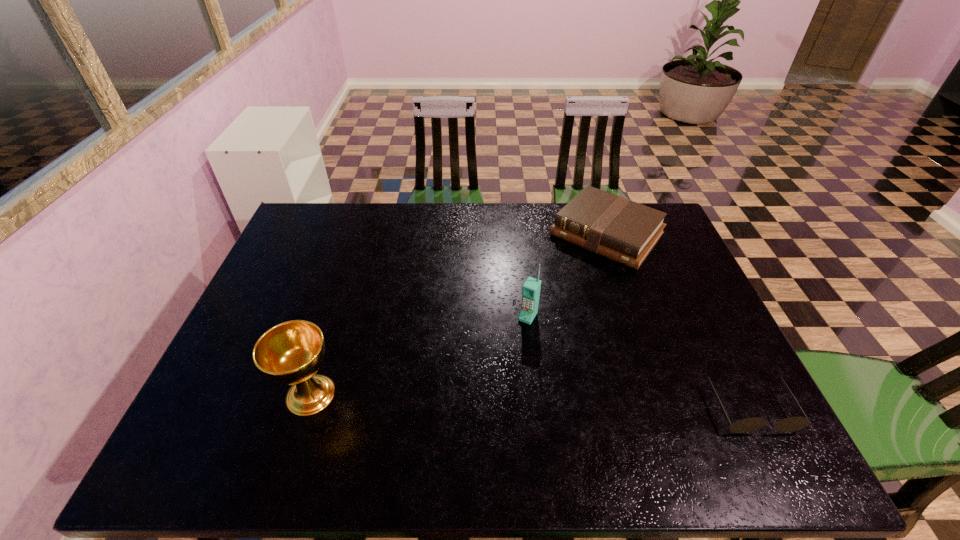
Locate an element on the screen. free spot at the far edge of the desktop is located at coordinates (376, 208).

Identify the location of free point at the near edge. The image size is (960, 540). (506, 406).

Image resolution: width=960 pixels, height=540 pixels. Find the location of `vacant space at the left edge of the desktop`. vacant space at the left edge of the desktop is located at coordinates (293, 275).

This screenshot has width=960, height=540. In order to click on vacant space at the right edge of the desktop in this screenshot , I will do `click(687, 269)`.

Identify the location of vacant space at the far left corner. (341, 223).

In the image, there is a desktop. Where is `vacant space at the near left corner`? vacant space at the near left corner is located at coordinates (x=247, y=391).

Image resolution: width=960 pixels, height=540 pixels. What are the coordinates of `vacant position at the near right corner of the desktop` in the screenshot? It's located at (748, 406).

The height and width of the screenshot is (540, 960). I want to click on unoccupied area between the Bible and the second object from left to right, so click(x=567, y=275).

This screenshot has height=540, width=960. In order to click on free spot between the farthest object and the chalice in this screenshot , I will do `click(459, 314)`.

You are a GUI agent. You are given a task and a screenshot of the screen. Output one action in this format:
    pyautogui.click(x=<x>, y=<y>)
    Task: Click on the empty space between the shortest object and the farthest object
    Image resolution: width=960 pixels, height=540 pixels.
    Given the screenshot: What is the action you would take?
    pyautogui.click(x=679, y=321)